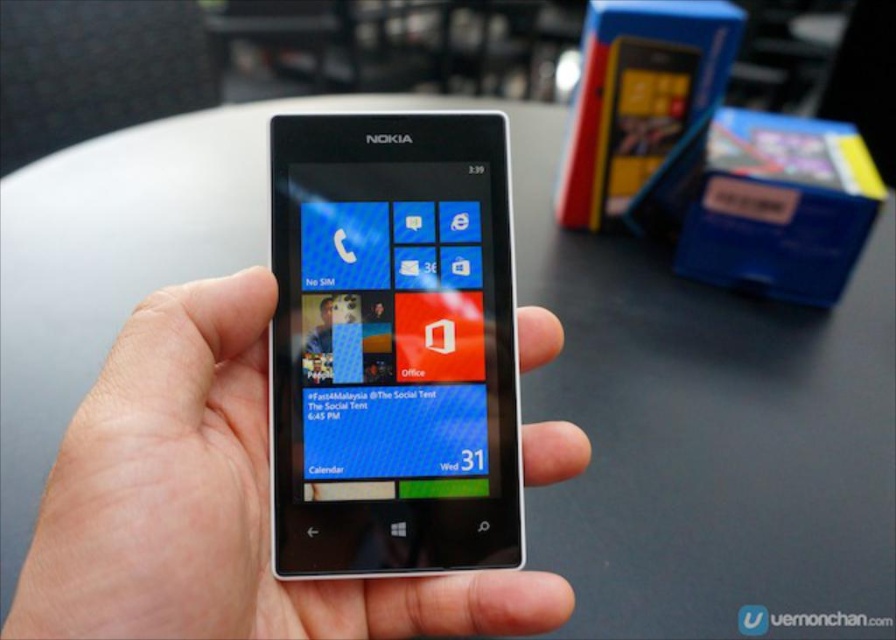
What are the coordinates of the white matte phone at center in the image?

The white matte phone at center is located at point (x=213, y=504).